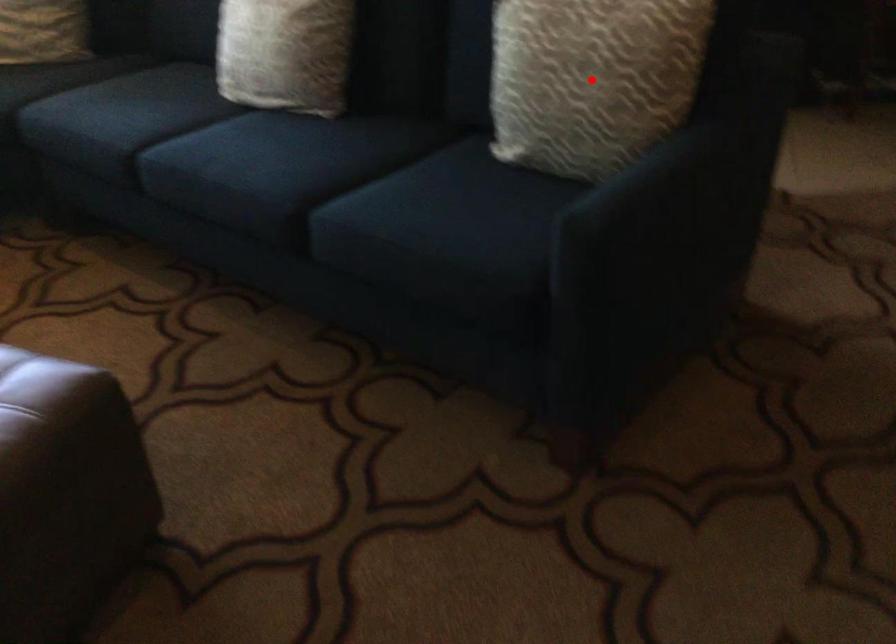
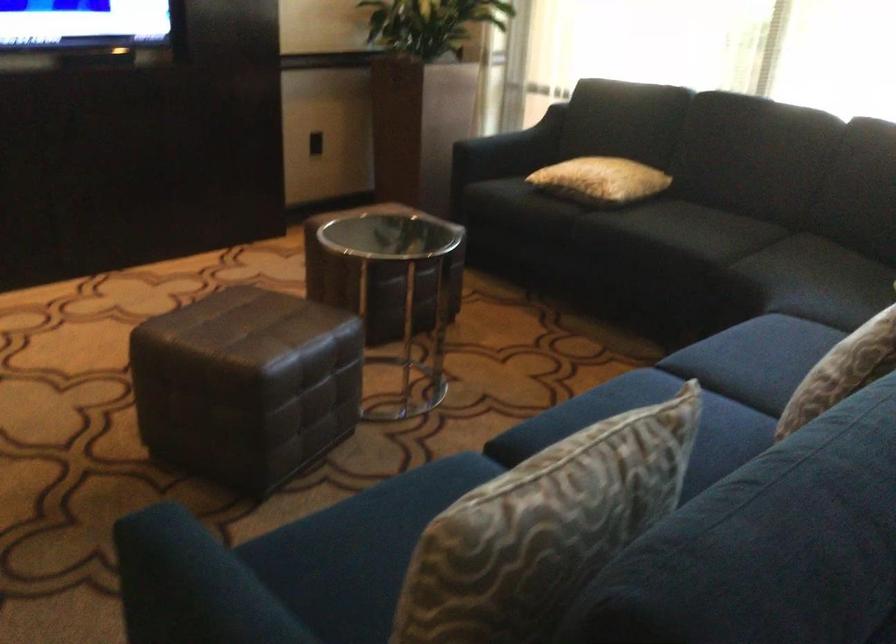
Question: I am providing you with two images of the same scene from different viewpoints. A red point is marked on the first image. Can you still see the location of the red point in image 2?

Choices:
 (A) Yes
 (B) No

Answer: (B)